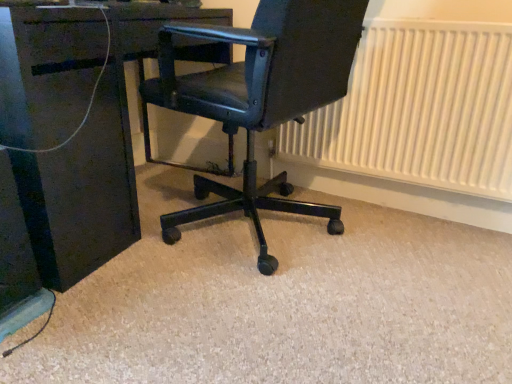
Question: From their relative heights in the image, would you say matte black office chair at center is taller or shorter than matte black desk at center?

Choices:
 (A) short
 (B) tall

Answer: (B)

Question: From a real-world perspective, is matte black office chair at center positioned above or below matte black desk at center?

Choices:
 (A) below
 (B) above

Answer: (B)

Question: Which object is positioned closest to the matte black office chair at center?

Choices:
 (A) matte black desk at center
 (B) white textured radiator at right

Answer: (A)

Question: Which object is positioned farthest from the white textured radiator at right?

Choices:
 (A) matte black office chair at center
 (B) matte black desk at center

Answer: (B)